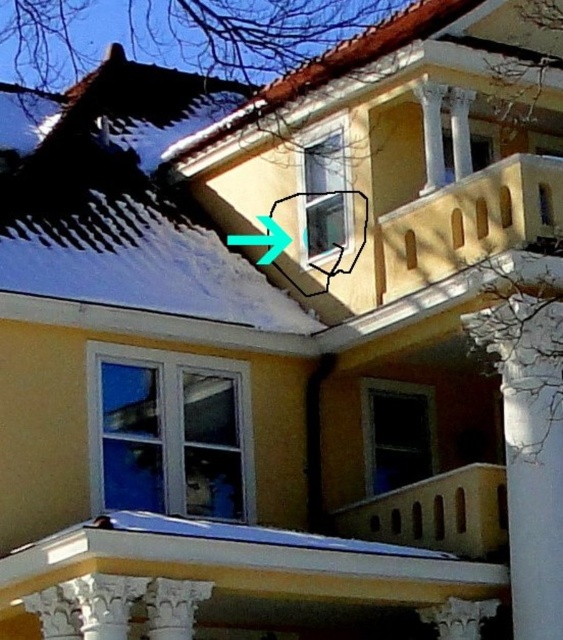
Which of these two, smooth shingles roof at upper center or green plastic arrow at upper center, stands taller?

With more height is smooth shingles roof at upper center.

This screenshot has width=563, height=640. I want to click on smooth shingles roof at upper center, so (x=396, y=72).

Find the location of a particular element. smooth shingles roof at upper center is located at coordinates (396, 72).

Between smooth shingles at upper left and green plastic arrow at upper center, which one is positioned lower?

green plastic arrow at upper center

Who is shorter, smooth shingles at upper left or green plastic arrow at upper center?

green plastic arrow at upper center is shorter.

Does point (81, 276) come closer to viewer compared to point (269, 236)?

Yes, it is.

This screenshot has width=563, height=640. Identify the location of smooth shingles at upper left. (122, 202).

Based on the photo, is smooth shingles at upper left above smooth shingles roof at upper center?

Actually, smooth shingles at upper left is below smooth shingles roof at upper center.

Does smooth shingles at upper left have a greater width compared to smooth shingles roof at upper center?

No.

Find the location of a particular element. The image size is (563, 640). smooth shingles at upper left is located at coordinates (122, 202).